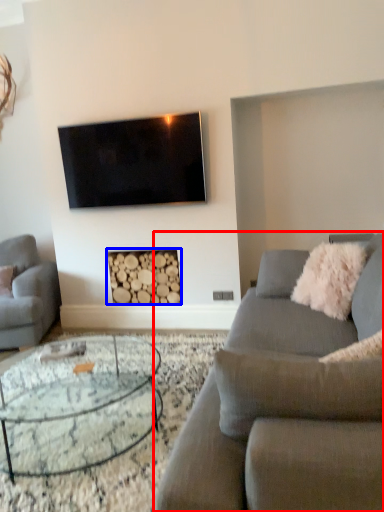
Question: Which of the following is the closest to the observer, studio couch (highlighted by a red box) or fireplace (highlighted by a blue box)?

Choices:
 (A) studio couch
 (B) fireplace

Answer: (A)